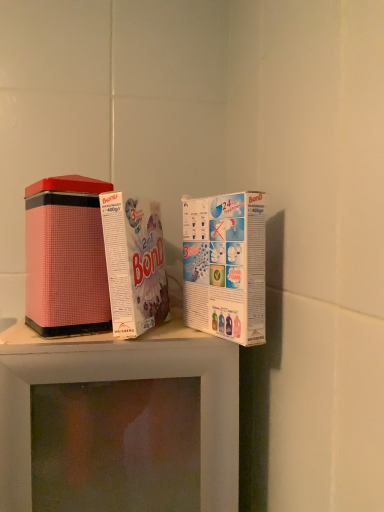
Question: Is pink matte tin can at left, which is counted as the 3th product, starting from the right, aimed at pink matte tin at center, the second product from the right?

Choices:
 (A) yes
 (B) no

Answer: (B)

Question: From the image's perspective, would you say pink matte tin can at left, which is counted as the 3th product, starting from the right, is shown under pink matte tin at center, the second product from the right?

Choices:
 (A) yes
 (B) no

Answer: (A)

Question: Are pink matte tin can at left, which is counted as the 3th product, starting from the right, and pink matte tin at center, the second product from the right, making contact?

Choices:
 (A) no
 (B) yes

Answer: (B)

Question: Considering the relative sizes of pink matte tin can at left, which is counted as the 3th product, starting from the right, and pink matte tin at center, the 2th product when ordered from left to right, in the image provided, is pink matte tin can at left, which is counted as the 3th product, starting from the right, bigger than pink matte tin at center, the 2th product when ordered from left to right,?

Choices:
 (A) no
 (B) yes

Answer: (B)

Question: Is pink matte tin can at left, which is counted as the 3th product, starting from the right, at the left side of pink matte tin at center, the 2th product when ordered from left to right?

Choices:
 (A) no
 (B) yes

Answer: (B)

Question: From the image's perspective, does pink matte tin can at left, positioned as the 1th product in left-to-right order, appear higher than pink matte tin at center, the second product from the right?

Choices:
 (A) no
 (B) yes

Answer: (A)

Question: Does pink matte tin at center, the 2th product when ordered from left to right, appear on the left side of white cardboard box at upper right, which is counted as the 3th product, starting from the left?

Choices:
 (A) no
 (B) yes

Answer: (B)

Question: Does pink matte tin at center, the 2th product when ordered from left to right, have a lesser width compared to white cardboard box at upper right, placed as the 1th product when sorted from right to left?

Choices:
 (A) no
 (B) yes

Answer: (A)

Question: Is pink matte tin at center, the 2th product when ordered from left to right, facing towards white cardboard box at upper right, placed as the 1th product when sorted from right to left?

Choices:
 (A) no
 (B) yes

Answer: (A)

Question: Are pink matte tin at center, the 2th product when ordered from left to right, and white cardboard box at upper right, placed as the 1th product when sorted from right to left, located far from each other?

Choices:
 (A) no
 (B) yes

Answer: (A)

Question: Is pink matte tin at center, the 2th product when ordered from left to right, placed right next to white cardboard box at upper right, placed as the 1th product when sorted from right to left?

Choices:
 (A) no
 (B) yes

Answer: (B)

Question: Is pink matte tin at center, the 2th product when ordered from left to right, outside of white cardboard box at upper right, placed as the 1th product when sorted from right to left?

Choices:
 (A) yes
 (B) no

Answer: (A)

Question: Is white cardboard box at upper right, placed as the 1th product when sorted from right to left, positioned before pink matte tin at center, the second product from the right?

Choices:
 (A) no
 (B) yes

Answer: (B)